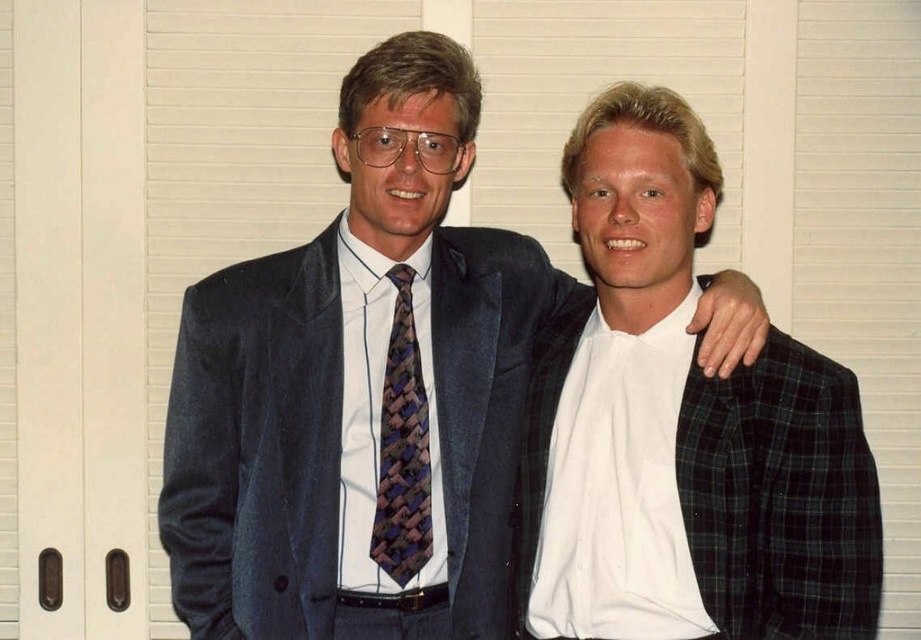
You are organizing a charity event and need to display two items from the image on a table. The items are the suede suit at center and the woven silk tie at center. According to their positions in the image, which item should you place on the left side of the table?

The suede suit at center should be placed on the left side of the table because it is positioned to the left of the woven silk tie at center in the image.